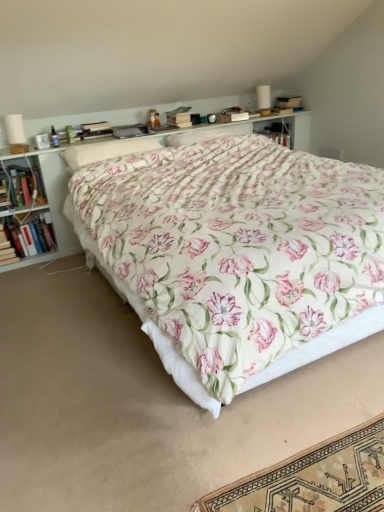
Question: Can you confirm if floral fabric pillow at center, positioned as the second pillow in right-to-left order, is bigger than hardcover book at left, arranged as the 2th book when ordered from the bottom?

Choices:
 (A) no
 (B) yes

Answer: (B)

Question: From the image's perspective, does floral fabric pillow at center, which ranks as the 1th pillow in left-to-right order, appear lower than hardcover book at left, arranged as the 2th book when ordered from the bottom?

Choices:
 (A) yes
 (B) no

Answer: (B)

Question: Is floral fabric pillow at center, positioned as the second pillow in right-to-left order, outside hardcover book at left, arranged as the 2th book when ordered from the bottom?

Choices:
 (A) yes
 (B) no

Answer: (A)

Question: Is floral fabric pillow at center, which ranks as the 1th pillow in left-to-right order, positioned in front of hardcover book at left, arranged as the second book when viewed from the top?

Choices:
 (A) no
 (B) yes

Answer: (B)

Question: Does floral fabric pillow at center, which ranks as the 1th pillow in left-to-right order, have a lesser height compared to hardcover book at left, arranged as the second book when viewed from the top?

Choices:
 (A) no
 (B) yes

Answer: (B)

Question: From a real-world perspective, is floral fabric pillow at center, which ranks as the 1th pillow in left-to-right order, located higher than hardcover book at left, arranged as the second book when viewed from the top?

Choices:
 (A) yes
 (B) no

Answer: (A)

Question: Is floral fabric pillow at center, which ranks as the second pillow in left-to-right order, positioned in front of hardcover book at left, arranged as the second book when viewed from the top?

Choices:
 (A) no
 (B) yes

Answer: (B)

Question: Could you tell me if floral fabric pillow at center, which ranks as the second pillow in left-to-right order, is turned towards hardcover book at left, arranged as the second book when viewed from the top?

Choices:
 (A) no
 (B) yes

Answer: (A)

Question: Is floral fabric pillow at center, which is the 1th pillow from right to left, surrounding hardcover book at left, arranged as the 2th book when ordered from the bottom?

Choices:
 (A) no
 (B) yes

Answer: (A)

Question: Is floral fabric pillow at center, which is the 1th pillow from right to left, shorter than hardcover book at left, arranged as the second book when viewed from the top?

Choices:
 (A) no
 (B) yes

Answer: (B)

Question: Is floral fabric pillow at center, which is the 1th pillow from right to left, to the left of hardcover book at left, arranged as the second book when viewed from the top, from the viewer's perspective?

Choices:
 (A) no
 (B) yes

Answer: (A)

Question: Is floral cotton bed at center looking in the opposite direction of floral fabric pillow at center, positioned as the second pillow in right-to-left order?

Choices:
 (A) no
 (B) yes

Answer: (A)